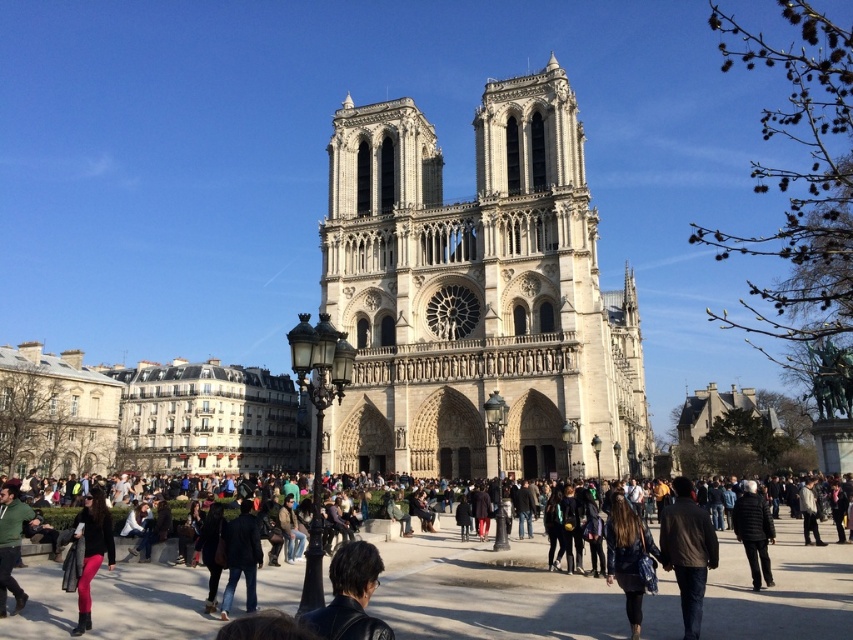
Between white stone tower at center and dark brown leather jacket at lower left, which one is positioned higher?

white stone tower at center

Can you confirm if white stone tower at center is smaller than dark brown leather jacket at lower left?

No.

Does point (427, 228) come in front of point (503, 584)?

No, it is behind (503, 584).

This screenshot has width=853, height=640. Find the location of `white stone tower at center`. white stone tower at center is located at coordinates coord(477,296).

Can you confirm if matte black coat at lower left is taller than green matte jacket at lower left?

Correct, matte black coat at lower left is much taller as green matte jacket at lower left.

Between point (90, 534) and point (22, 506), which one is positioned in front?

Point (90, 534) is in front.

Between point (96, 522) and point (28, 509), which one is positioned in front?

Positioned in front is point (96, 522).

What are the coordinates of `matte black coat at lower left` in the screenshot? It's located at (91, 550).

Who is shorter, dark blue jeans at center or green matte jacket at lower left?

dark blue jeans at center is shorter.

Is dark blue jeans at center bigger than green matte jacket at lower left?

No, dark blue jeans at center is not bigger than green matte jacket at lower left.

Does point (242, 550) come closer to viewer compared to point (12, 484)?

Yes, point (242, 550) is in front of point (12, 484).

Where is `dark blue jeans at center`? The width and height of the screenshot is (853, 640). dark blue jeans at center is located at coordinates (241, 556).